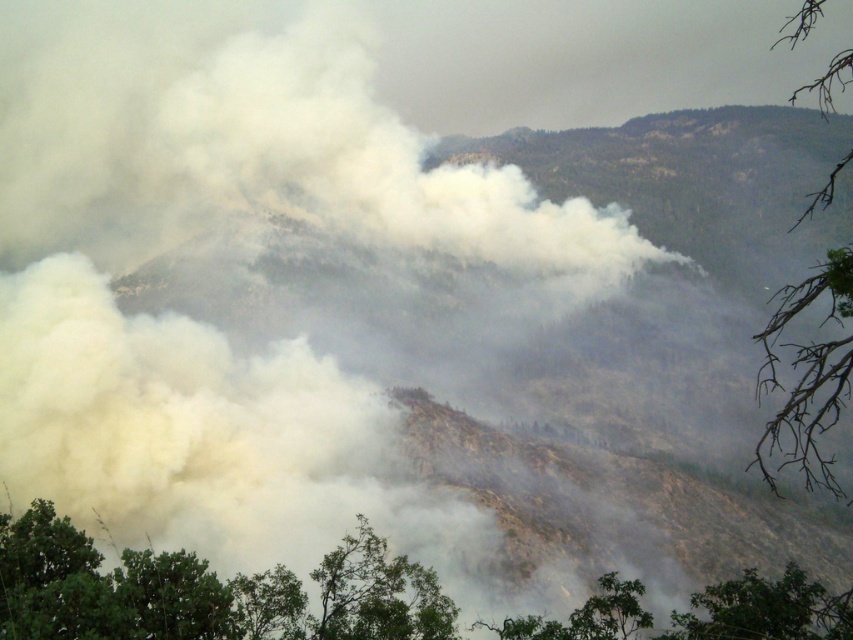
Question: Among these objects, which one is farthest from the camera?

Choices:
 (A) brown/dry branches at right
 (B) green leafy tree at lower right

Answer: (B)

Question: Which of these objects is positioned farthest from the green leafy tree at lower center?

Choices:
 (A) brown/dry branches at right
 (B) green leafy tree at lower right

Answer: (A)

Question: Considering the relative positions of brown/dry branches at right and green leafy tree at lower right in the image provided, where is brown/dry branches at right located with respect to green leafy tree at lower right?

Choices:
 (A) left
 (B) right

Answer: (B)

Question: Which object is the closest to the brown/dry branches at right?

Choices:
 (A) green leafy tree at lower center
 (B) green leafy tree at lower right

Answer: (A)

Question: Does green leafy tree at lower center appear under green leafy tree at lower right?

Choices:
 (A) no
 (B) yes

Answer: (A)

Question: Can you confirm if green leafy tree at lower center is positioned to the right of green leafy tree at lower right?

Choices:
 (A) no
 (B) yes

Answer: (A)